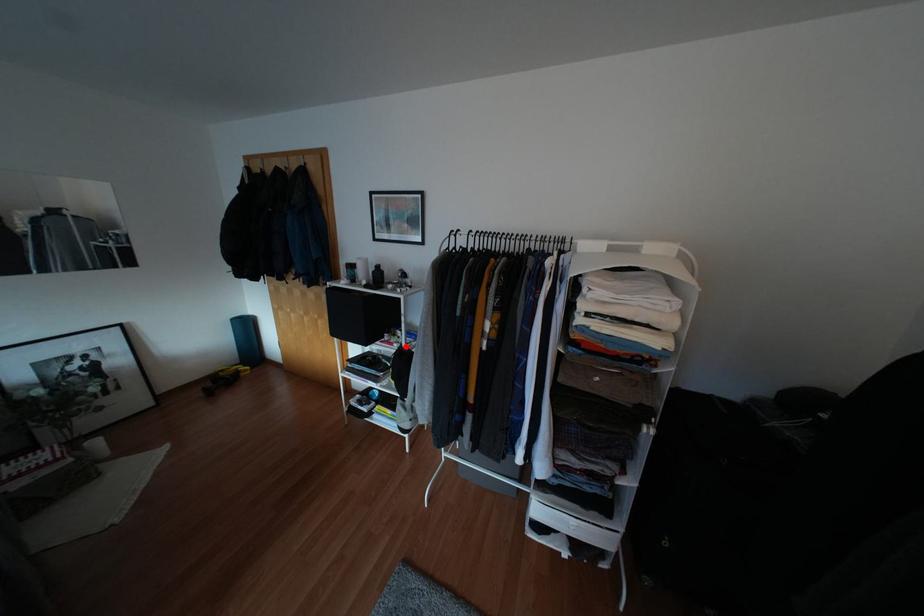
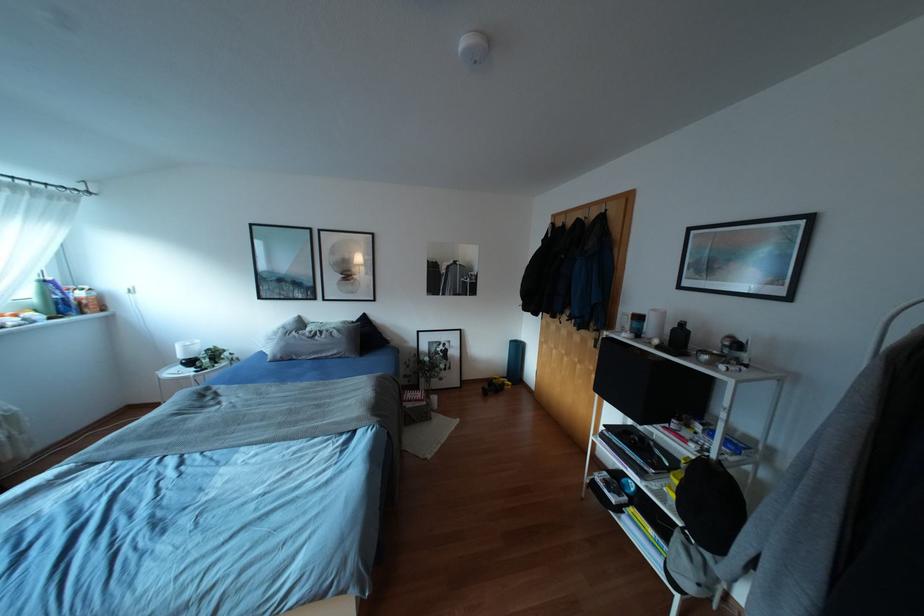
Find the pixel in the second image that matches the highlighted location in the first image.

(719, 461)